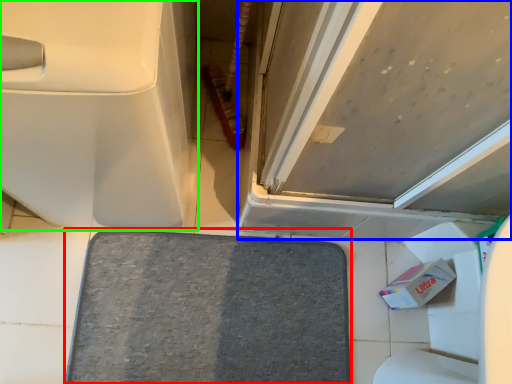
Question: Estimate the real-world distances between objects in this image. Which object is farther from bath mat (highlighted by a red box), door (highlighted by a blue box) or toilet (highlighted by a green box)?

Choices:
 (A) door
 (B) toilet

Answer: (B)